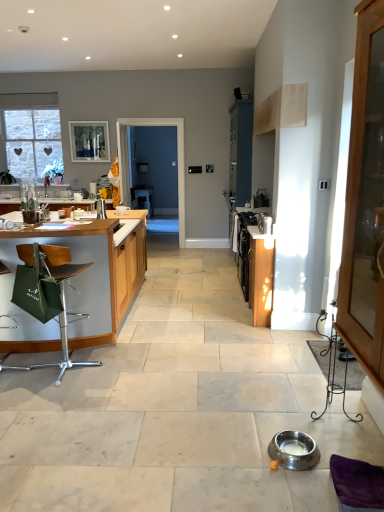
What are the coordinates of `vacant space in between stainless steel bowl at lower center, acting as the 2th appliance starting from the top, and green leather chair at left` in the screenshot? It's located at (162, 404).